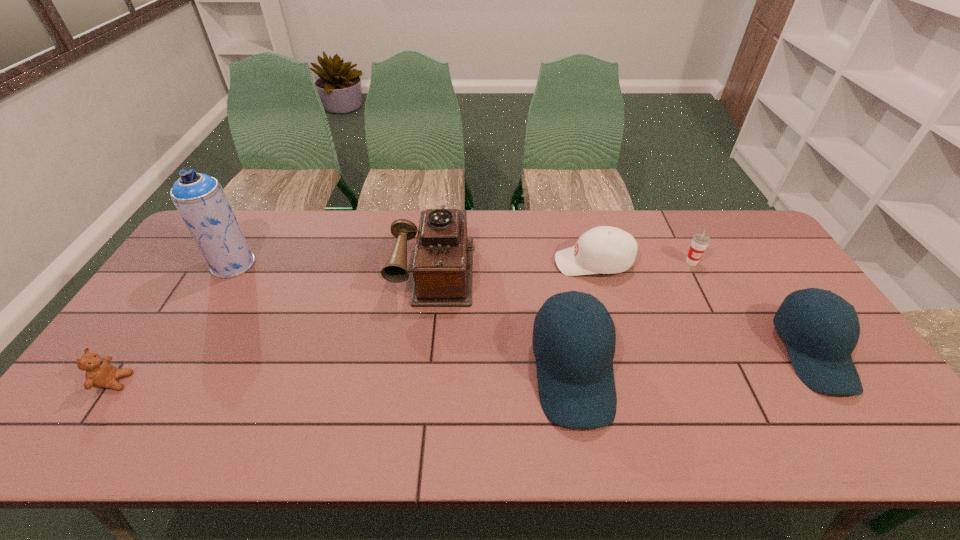
In the current image, all baseball caps are evenly spaced. To maintain this equal spacing, where should an additional baseball cap be placed on the left? Please point out a free spot. Please provide its 2D coordinates. Your answer should be formatted as a tuple, i.e. [(x, y)], where the tuple contains the x and y coordinates of a point satisfying the conditions above.

[(314, 393)]